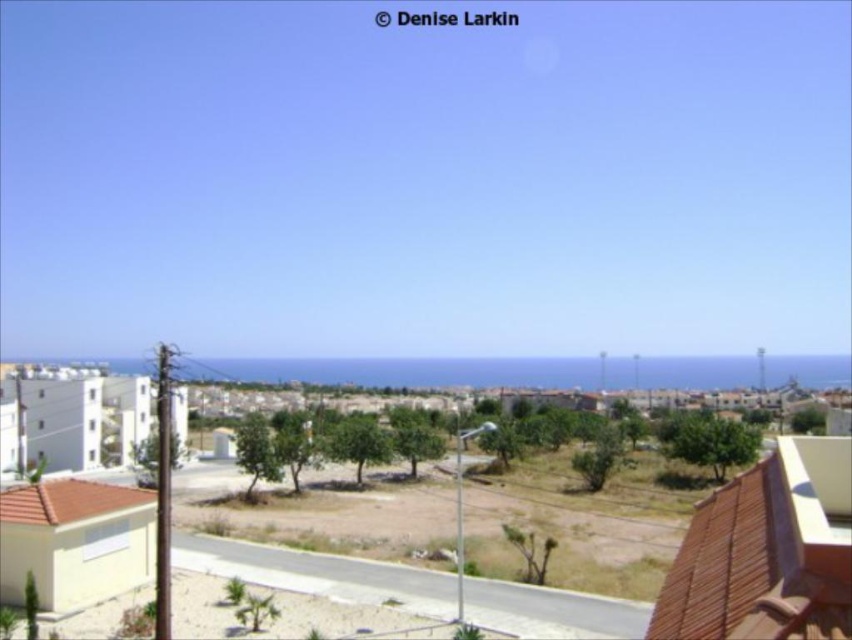
Question: Observing the image, what is the correct spatial positioning of brown tile balcony at lower right in reference to blue ocean at center?

Choices:
 (A) below
 (B) above

Answer: (B)

Question: Is brown tile balcony at lower right positioned behind blue ocean at center?

Choices:
 (A) no
 (B) yes

Answer: (A)

Question: Which object is farther from the camera taking this photo?

Choices:
 (A) blue ocean at center
 (B) brown tile balcony at lower right

Answer: (A)

Question: Can you confirm if brown tile balcony at lower right is positioned to the left of blue ocean at center?

Choices:
 (A) no
 (B) yes

Answer: (B)

Question: Which object is closer to the camera taking this photo?

Choices:
 (A) blue ocean at center
 (B) brown tile balcony at lower right

Answer: (B)